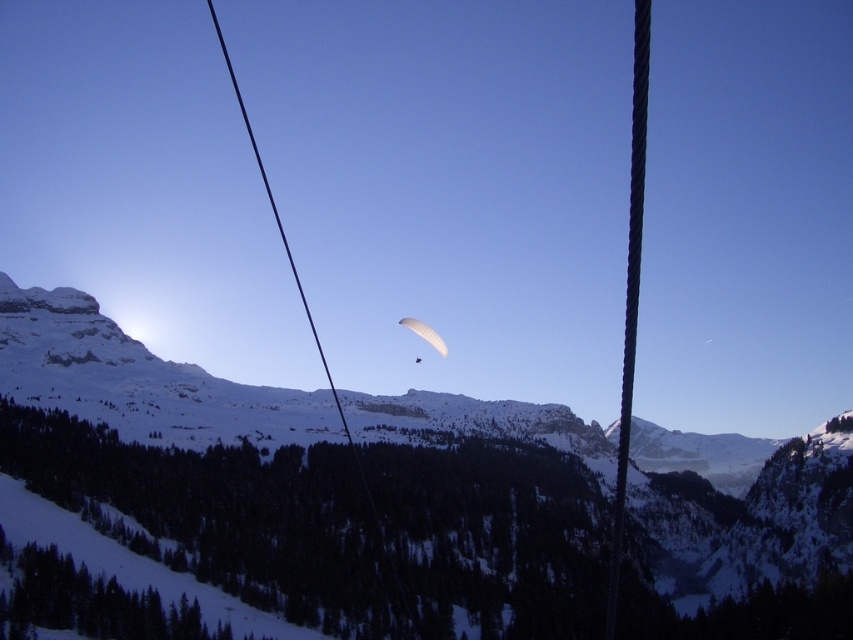
You are standing at the base of the snowy rocky mountain at center and looking towards the black wire at center. Which object is closer to you?

The snowy rocky mountain at center is closer to you than the black wire at center.

You are standing at the viewpoint and see two points in the mountain landscape. The first point is located at coordinates point (25, 470) and the second at point (416, 332). Which point is closer to you?

Point (25, 470) is closer to the camera than point (416, 332), so the first point is closer to you.